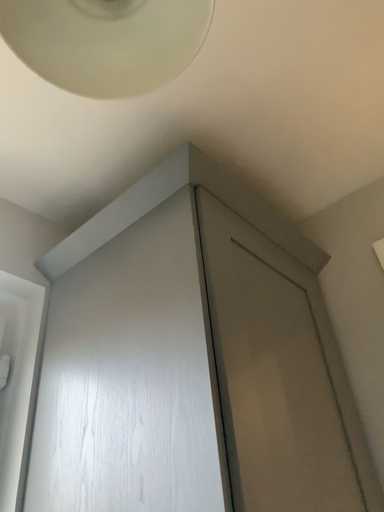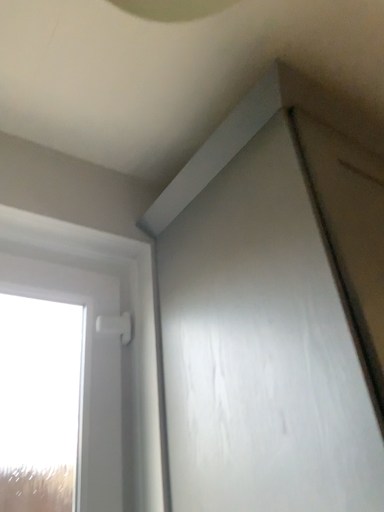
Question: Which way did the camera rotate in the video?

Choices:
 (A) rotated upward
 (B) rotated downward

Answer: (B)